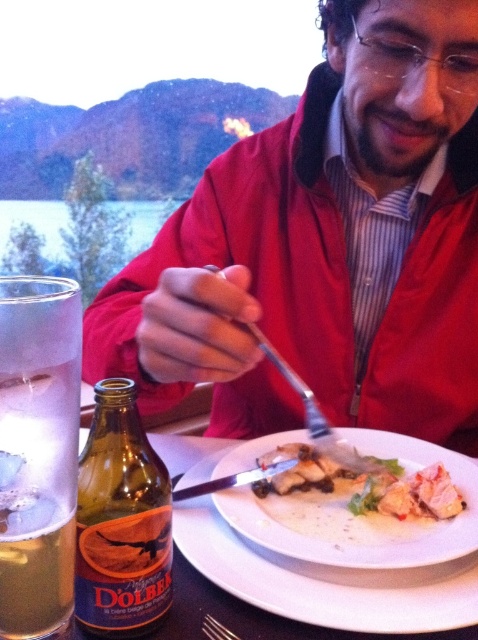
Is point (20, 538) more distant than point (311, 397)?

No, (20, 538) is closer to viewer.

Can you confirm if clear glass at upper left is positioned to the left of satin silver fork at plate center?

Correct, you'll find clear glass at upper left to the left of satin silver fork at plate center.

At what (x,y) coordinates should I click in order to perform the action: click on clear glass at upper left. Please return your answer as a coordinate pair (x, y). The width and height of the screenshot is (478, 640). Looking at the image, I should click on (37, 451).

You are a GUI agent. You are given a task and a screenshot of the screen. Output one action in this format:
    pyautogui.click(x=<x>, y=<y>)
    Task: Click on the clear glass at upper left
    
    Given the screenshot: What is the action you would take?
    pyautogui.click(x=37, y=451)

Between matte red jacket at center and clear glass at upper left, which one appears on the right side from the viewer's perspective?

From the viewer's perspective, matte red jacket at center appears more on the right side.

The image size is (478, 640). What do you see at coordinates (321, 250) in the screenshot?
I see `matte red jacket at center` at bounding box center [321, 250].

Identify the location of matte red jacket at center. (321, 250).

Looking at this image, does clear glass at upper left have a greater width compared to white matte plate at center?

In fact, clear glass at upper left might be narrower than white matte plate at center.

Image resolution: width=478 pixels, height=640 pixels. I want to click on clear glass at upper left, so click(x=37, y=451).

The image size is (478, 640). I want to click on clear glass at upper left, so click(x=37, y=451).